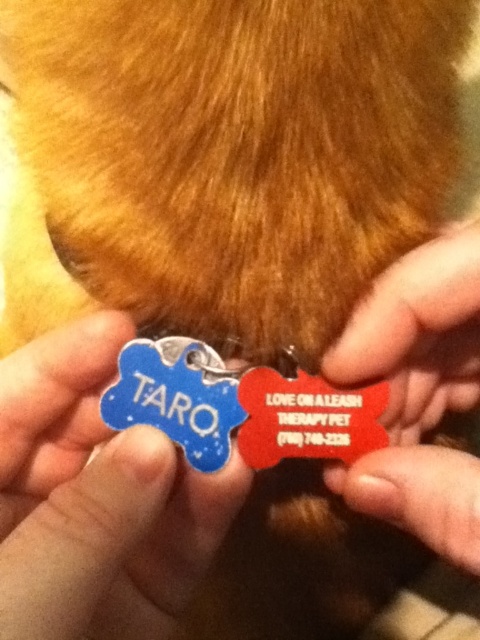
You are a pet store employee organizing items. You have two items to place on a shelf. The blue enamel bone at center and the matte plastic pet tag at center. The shelf has limited vertical space. Which item should you place first to ensure both fit vertically?

The blue enamel bone at center is taller than the matte plastic pet tag at center, so you should place the blue enamel bone at center first to accommodate its height, then the matte plastic pet tag at center will fit below or beside it within the vertical space available.

You are a dog owner who just found two dog tags on the ground. The blue enamel bone at center has the name TARO, and the other tag is red with text. If your dog is wearing a collar that can only hold tags spaced 10 inches apart, will these two tags fit together on the collar?

The blue enamel bone at center and the red tag are 10.27 inches apart, which exceeds the collar spacing of 10 inches. Therefore, the tags will not fit together on the collar.